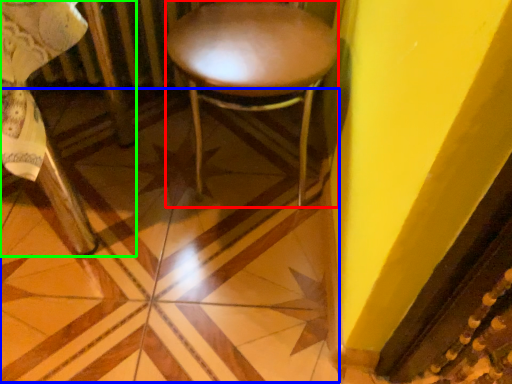
Question: Considering the real-world distances, which object is closest to stool (highlighted by a red box)? tile (highlighted by a blue box) or chair (highlighted by a green box).

Choices:
 (A) tile
 (B) chair

Answer: (A)